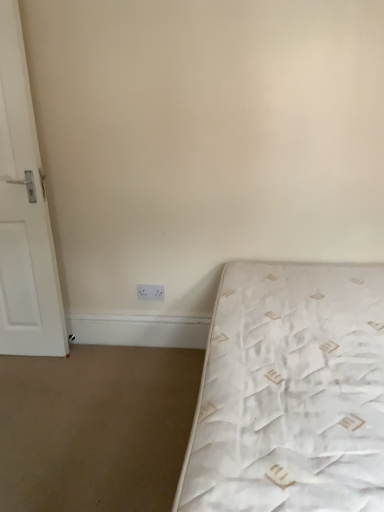
The height and width of the screenshot is (512, 384). In order to click on white plastic electric outlet at lower center in this screenshot , I will do `click(150, 292)`.

In order to face white matte door at left, should I rotate leftwards or rightwards?

You should rotate left by 23.793 degrees.

Where is `white plastic electric outlet at lower center`? white plastic electric outlet at lower center is located at coordinates (150, 292).

In the scene shown: Is there a large distance between white plastic electric outlet at lower center and white matte door at left?

No.

Is white plastic electric outlet at lower center in front of or behind white matte door at left in the image?

white plastic electric outlet at lower center is positioned farther from the viewer than white matte door at left.

Can you confirm if white plastic electric outlet at lower center is positioned to the left of white matte door at left?

Incorrect, white plastic electric outlet at lower center is not on the left side of white matte door at left.

Is there a large distance between white matte door at left and white quilted mattress at lower right?

That's right, there is a large distance between white matte door at left and white quilted mattress at lower right.

Considering the relative positions of white matte door at left and white quilted mattress at lower right in the image provided, is white matte door at left to the left or to the right of white quilted mattress at lower right?

white matte door at left is positioned on white quilted mattress at lower right's left side.

What's the angular difference between white matte door at left and white quilted mattress at lower right's facing directions?

The angle between the facing direction of white matte door at left and the facing direction of white quilted mattress at lower right is 0.502 degrees.

Which point is more distant from viewer, [54,352] or [184,473]?

Point [54,352]

Could you tell me if white quilted mattress at lower right is facing white plastic electric outlet at lower center?

No, white quilted mattress at lower right does not turn towards white plastic electric outlet at lower center.

Is white quilted mattress at lower right far away from white plastic electric outlet at lower center?

Yes, white quilted mattress at lower right and white plastic electric outlet at lower center are quite far apart.

Could white plastic electric outlet at lower center be considered to be inside white quilted mattress at lower right?

No.

Can we say white quilted mattress at lower right lies outside white matte door at left?

Absolutely, white quilted mattress at lower right is external to white matte door at left.

Does white quilted mattress at lower right turn towards white matte door at left?

No, white quilted mattress at lower right is not facing towards white matte door at left.

Considering the positions of points (315, 409) and (33, 177), is point (315, 409) closer to camera compared to point (33, 177)?

Yes, point (315, 409) is in front of point (33, 177).

Between white quilted mattress at lower right and white matte door at left, which one has smaller width?

Thinner between the two is white matte door at left.

Considering the relative sizes of white matte door at left and white plastic electric outlet at lower center in the image provided, is white matte door at left smaller than white plastic electric outlet at lower center?

Incorrect, white matte door at left is not smaller in size than white plastic electric outlet at lower center.

Can you confirm if white matte door at left is shorter than white plastic electric outlet at lower center?

No, white matte door at left is not shorter than white plastic electric outlet at lower center.

Measure the distance from white matte door at left to white plastic electric outlet at lower center.

The distance of white matte door at left from white plastic electric outlet at lower center is 28.20 inches.

Is white matte door at left positioned in front of white plastic electric outlet at lower center?

Yes, it is in front of white plastic electric outlet at lower center.

How many degrees apart are the facing directions of white plastic electric outlet at lower center and white quilted mattress at lower right?

The facing directions of white plastic electric outlet at lower center and white quilted mattress at lower right are 1.58 degrees apart.

From a real-world perspective, is white plastic electric outlet at lower center on top of white quilted mattress at lower right?

Correct, in the physical world, white plastic electric outlet at lower center is higher than white quilted mattress at lower right.

Are white plastic electric outlet at lower center and white quilted mattress at lower right located far from each other?

white plastic electric outlet at lower center is positioned a significant distance from white quilted mattress at lower right.

Based on their sizes in the image, would you say white plastic electric outlet at lower center is bigger or smaller than white quilted mattress at lower right?

In the image, white plastic electric outlet at lower center appears to be smaller than white quilted mattress at lower right.

The image size is (384, 512). What are the coordinates of `door that appears on the left of white plastic electric outlet at lower center` in the screenshot? It's located at (24, 213).

Image resolution: width=384 pixels, height=512 pixels. In order to click on bed in front of the white matte door at left in this screenshot , I will do `click(290, 392)`.

Estimate the real-world distances between objects in this image. Which object is closer to white plastic electric outlet at lower center, white matte door at left or white quilted mattress at lower right?

white matte door at left is closer to white plastic electric outlet at lower center.

When comparing their distances from white quilted mattress at lower right, does white matte door at left or white plastic electric outlet at lower center seem further?

The object further to white quilted mattress at lower right is white matte door at left.

Consider the image. Based on their spatial positions, is white quilted mattress at lower right or white plastic electric outlet at lower center further from white matte door at left?

white quilted mattress at lower right is further to white matte door at left.

From the image, which object appears to be farther from white matte door at left, white plastic electric outlet at lower center or white quilted mattress at lower right?

Based on the image, white quilted mattress at lower right appears to be further to white matte door at left.

From the image, which object appears to be farther from white quilted mattress at lower right, white plastic electric outlet at lower center or white matte door at left?

white matte door at left is positioned further to the anchor white quilted mattress at lower right.

Which object lies further to the anchor point white plastic electric outlet at lower center, white quilted mattress at lower right or white matte door at left?

Among the two, white quilted mattress at lower right is located further to white plastic electric outlet at lower center.

Locate an element on the screen. This screenshot has width=384, height=512. door located between white quilted mattress at lower right and white plastic electric outlet at lower center in the depth direction is located at coordinates (24, 213).